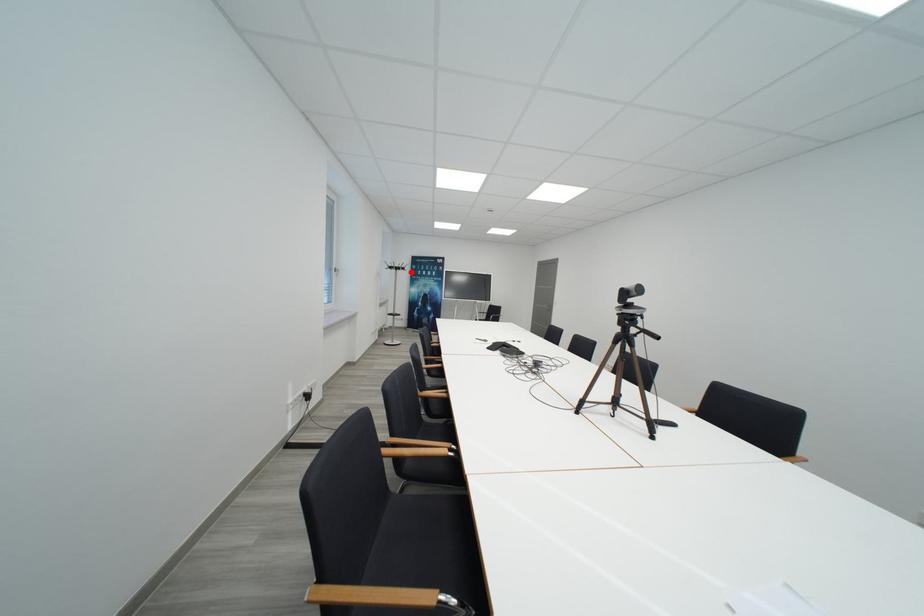
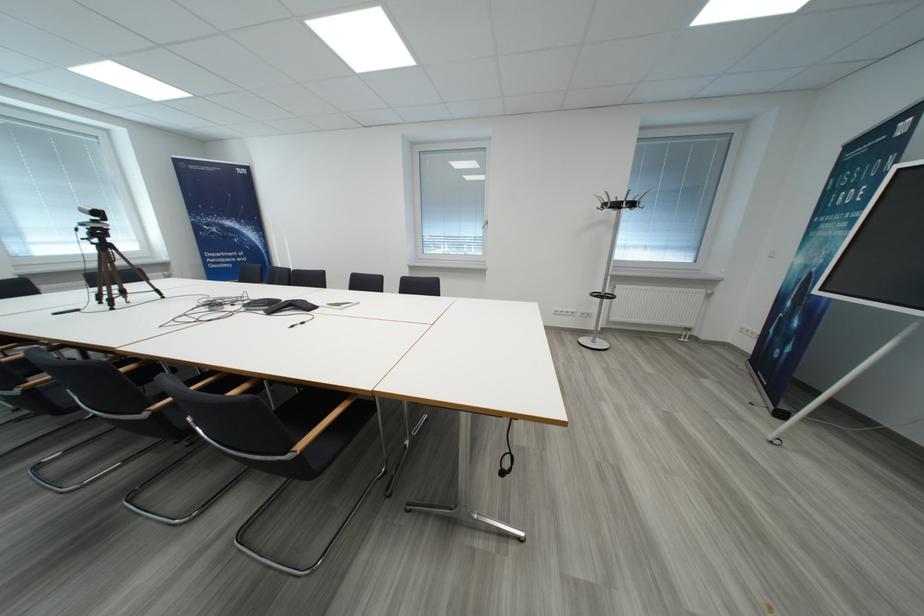
Question: I am providing you with two images of the same scene from different viewpoints. In image1, a red point is highlighted. Considering the same 3D point in image2, which of the following is correct?

Choices:
 (A) It is closer
 (B) It is farther

Answer: (B)